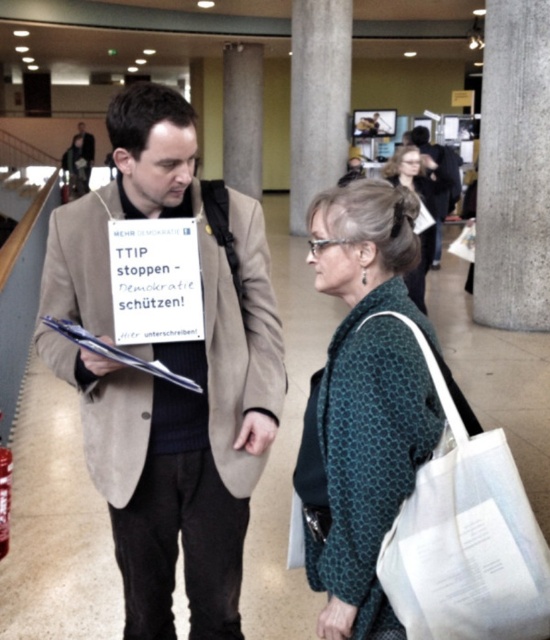
You are a photographer trying to capture a candid shot of the dark gray suit at upper left without including the suede beige coat at center in the frame. Is this possible based on their positions?

The suede beige coat at center is closer to the viewer than the dark gray suit at upper left, so it would block the view of the dark gray suit at upper left. Therefore, it is not possible to capture the dark gray suit at upper left without including the suede beige coat at center in the frame.

You are standing in the exhibition hall and notice two points marked on the floor. The first point is at coordinates point (x=355, y=477) and the second is at point (x=453, y=150). If you want to step closer to the camera, which point should you move towards?

You should move towards point (x=355, y=477) because it is closer to the camera compared to point (x=453, y=150).

You are a fashion designer observing the two outfits in the image. Which of the two items, the teal dotted sweater at center or the dark brown leather jacket at upper right, would you recommend for someone who prefers a more compact and less bulky look?

The teal dotted sweater at center has a smaller size compared to the dark brown leather jacket at upper right, so it would be the better recommendation for someone preferring a compact and less bulky look.